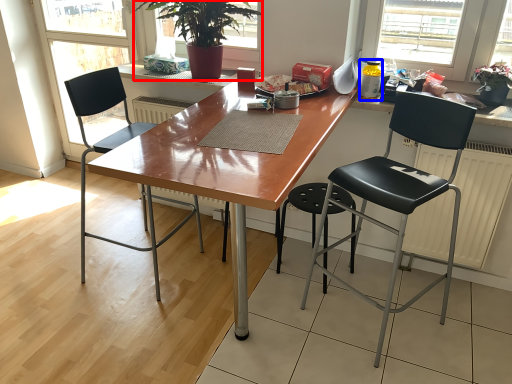
Question: Which point is further to the camera, houseplant (highlighted by a red box) or bottle (highlighted by a blue box)?

Choices:
 (A) houseplant
 (B) bottle

Answer: (B)